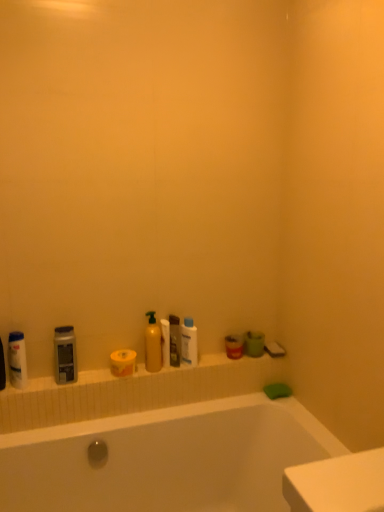
The width and height of the screenshot is (384, 512). What are the coordinates of `free space to the right of white matte bottle at left, placed as the first mouthwash when sorted from front to back` in the screenshot? It's located at pos(51,385).